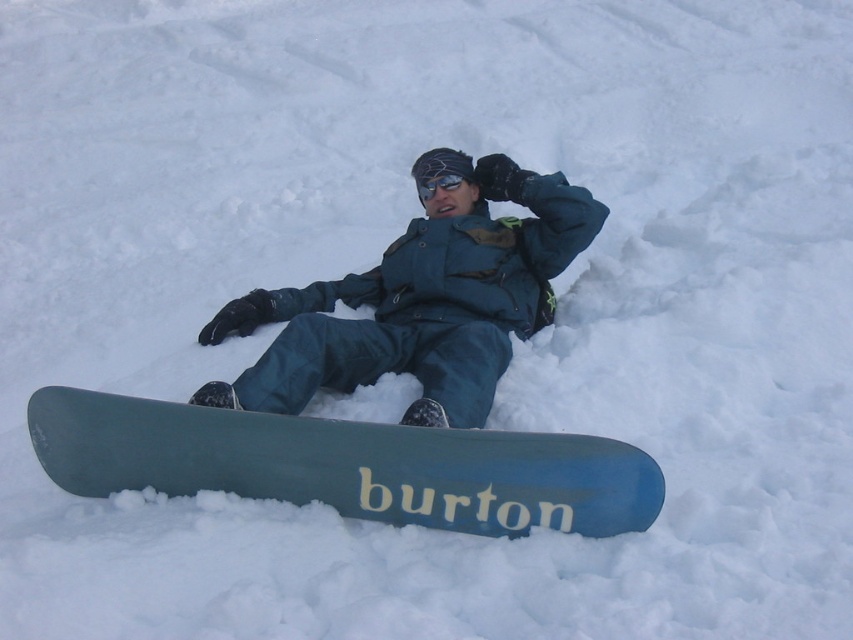
Which of these two, matte blue snowboard at center or black reflective goggles at center, stands taller?

With more height is matte blue snowboard at center.

Can you confirm if matte blue snowboard at center is wider than black reflective goggles at center?

Indeed, matte blue snowboard at center has a greater width compared to black reflective goggles at center.

Which is behind, point (146, 444) or point (421, 180)?

The point (421, 180) is more distant.

Where is `matte blue snowboard at center`? Image resolution: width=853 pixels, height=640 pixels. matte blue snowboard at center is located at coordinates (376, 380).

Between point (196, 460) and point (583, 212), which one is positioned behind?

The point (583, 212) is more distant.

Between blue matte snowboard at center and teal matte snowsuit at center, which one has less height?

With less height is blue matte snowboard at center.

Which is in front, point (598, 532) or point (323, 282)?

Point (598, 532)

Image resolution: width=853 pixels, height=640 pixels. I want to click on blue matte snowboard at center, so click(346, 465).

Which is more to the right, matte blue snowboard at center or teal matte snowsuit at center?

Positioned to the right is teal matte snowsuit at center.

Between point (309, 337) and point (440, 321), which one is positioned behind?

Positioned behind is point (440, 321).

Locate an element on the screen. matte blue snowboard at center is located at coordinates 376,380.